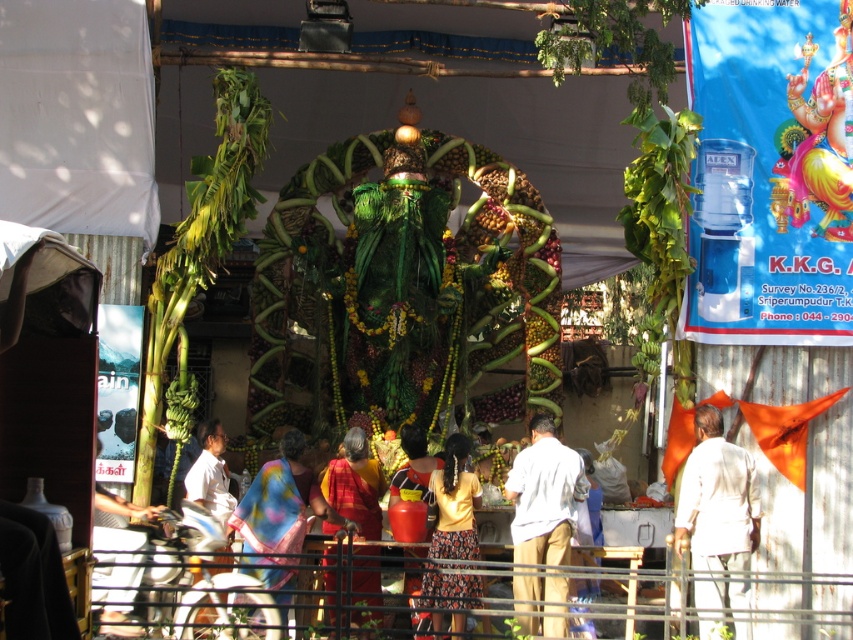
Question: Is yellow cotton dress at center smaller than white matte shirt at center?

Choices:
 (A) no
 (B) yes

Answer: (A)

Question: Considering the relative positions of white cloth at center and red silk saree at center in the image provided, where is white cloth at center located with respect to red silk saree at center?

Choices:
 (A) above
 (B) below

Answer: (A)

Question: Based on their relative distances, which object is nearer to the white cotton shirt at center?

Choices:
 (A) white cloth at center
 (B) silky pink saree at center

Answer: (A)

Question: Among these objects, which one is nearest to the camera?

Choices:
 (A) silky pink saree at center
 (B) white cotton shirt at center
 (C) white cloth at center

Answer: (A)

Question: Is metallic wire fence at lower center positioned behind red silk saree at center?

Choices:
 (A) no
 (B) yes

Answer: (B)

Question: Among these points, which one is farthest from the camera?

Choices:
 (A) [x=251, y=536]
 (B) [x=223, y=445]

Answer: (B)